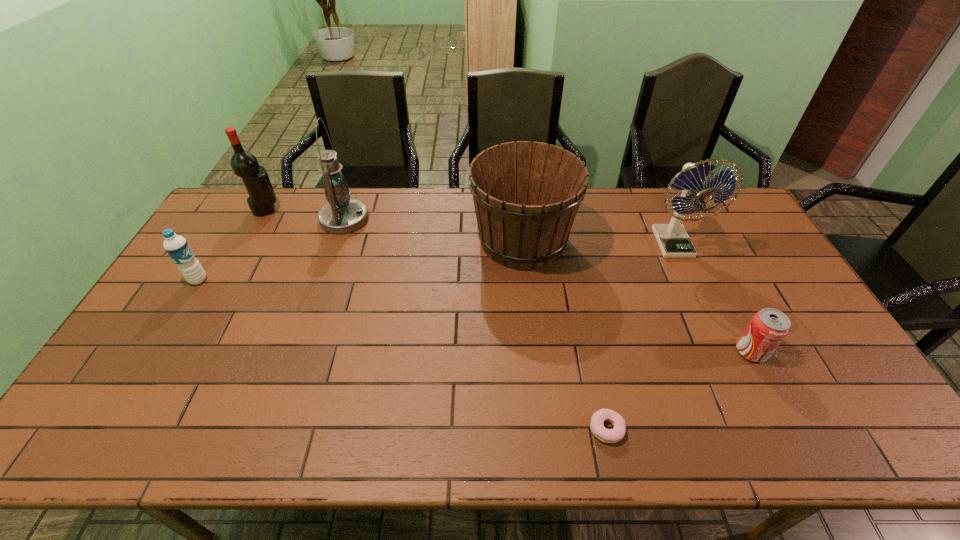
What are the coordinates of `free area in between the fourth shortest object and the shortest object` in the screenshot? It's located at (564, 335).

This screenshot has height=540, width=960. I want to click on blank region between the doughnut and the third object from left to right, so click(475, 324).

You are a GUI agent. You are given a task and a screenshot of the screen. Output one action in this format:
    pyautogui.click(x=<x>, y=<y>)
    Task: Click on the empty location between the fan and the wine bucket
    The width and height of the screenshot is (960, 540).
    Given the screenshot: What is the action you would take?
    pyautogui.click(x=598, y=242)

The height and width of the screenshot is (540, 960). Find the location of `free spot between the fourth shortest object and the second shortest object`. free spot between the fourth shortest object and the second shortest object is located at coordinates (636, 296).

Locate an element on the screen. Image resolution: width=960 pixels, height=540 pixels. vacant space that is in between the leftmost object and the second shortest object is located at coordinates pos(475,315).

This screenshot has width=960, height=540. In order to click on free space between the fan and the nearest object in this screenshot , I will do `click(639, 336)`.

This screenshot has width=960, height=540. In order to click on empty location between the soda can and the fan in this screenshot , I will do `click(712, 298)`.

The width and height of the screenshot is (960, 540). Identify the location of free space between the wine bottle and the fan. (469, 227).

This screenshot has width=960, height=540. Find the location of `vacant area that lies between the oil lamp and the soda can`. vacant area that lies between the oil lamp and the soda can is located at coordinates (548, 285).

In order to click on blank region between the fan and the wine bucket in this screenshot , I will do `click(598, 242)`.